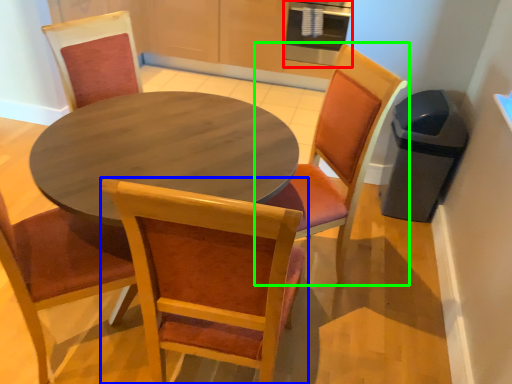
Question: Based on their relative distances, which object is farther from appliance (highlighted by a red box)? Choose from chair (highlighted by a blue box) and chair (highlighted by a green box).

Choices:
 (A) chair
 (B) chair

Answer: (A)